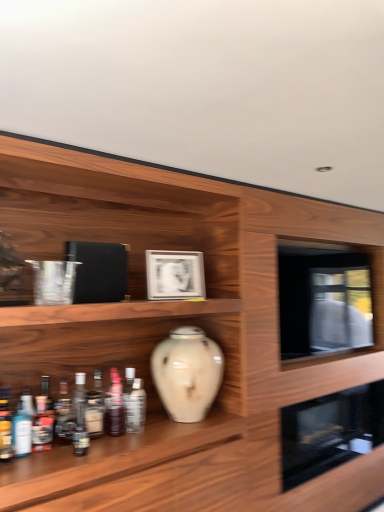
Find the location of a particular element. The width and height of the screenshot is (384, 512). free space above black glass oven at center, the second oven when ordered from bottom to top (from a real-world perspective) is located at coordinates (323, 246).